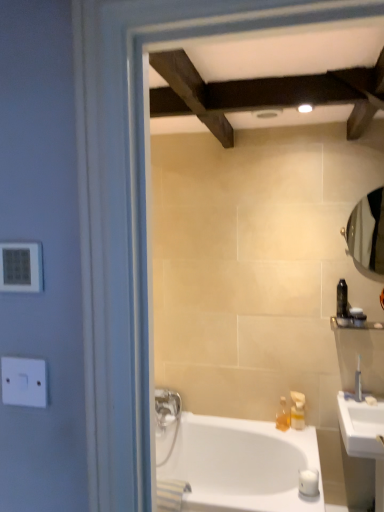
This screenshot has height=512, width=384. In order to click on vacant area that lies in front of translucent plastic soap dispenser at right, placed as the third toiletry when sorted from top to bottom in this screenshot , I will do `click(303, 438)`.